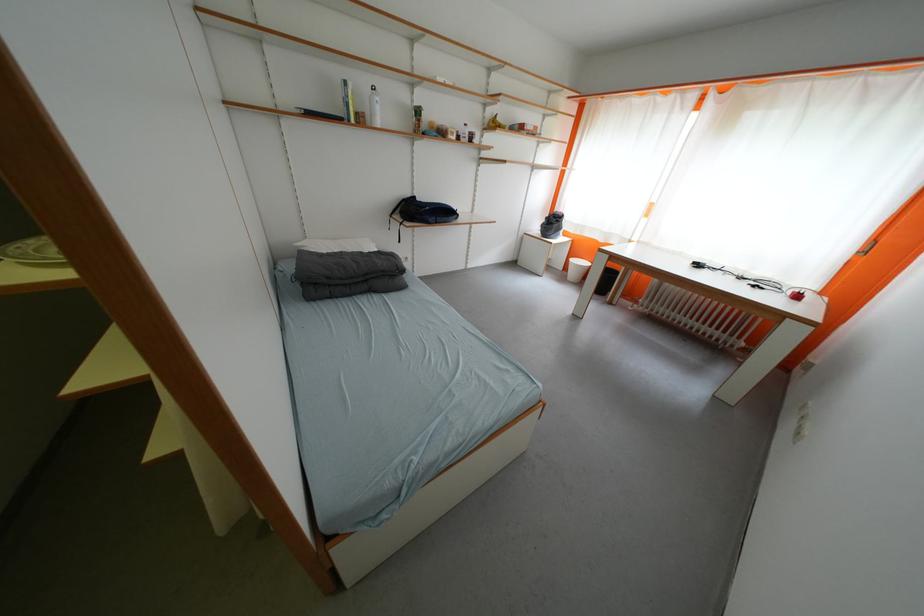
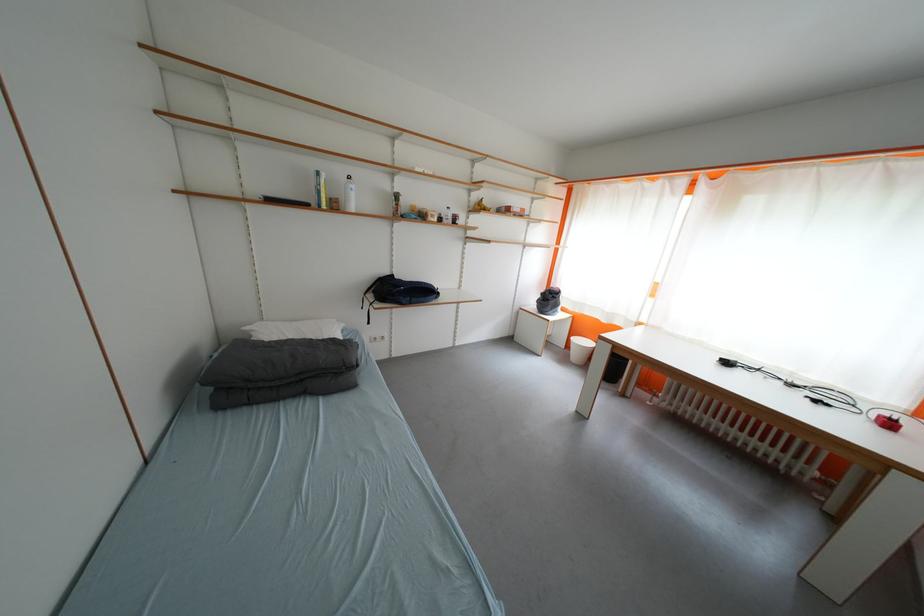
Find the pixel in the second image that matches pixel 806 300 in the first image.

(897, 428)